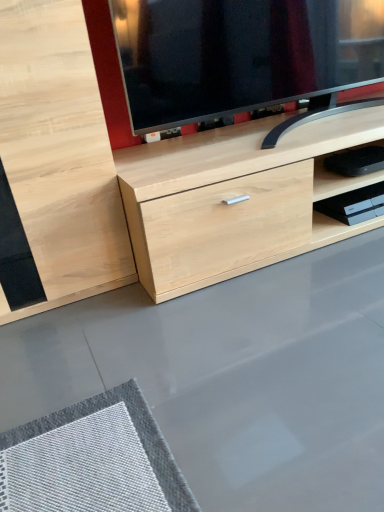
Question: From the image's perspective, is black plastic device at lower right located above or below black plastic shelf at lower right?

Choices:
 (A) above
 (B) below

Answer: (A)

Question: Is black plastic device at lower right wider or thinner than black plastic shelf at lower right?

Choices:
 (A) thin
 (B) wide

Answer: (B)

Question: From a real-world perspective, relative to black plastic shelf at lower right, is black plastic device at lower right vertically above or below?

Choices:
 (A) above
 (B) below

Answer: (A)

Question: Considering the positions of black plastic shelf at lower right and black plastic device at lower right in the image, is black plastic shelf at lower right bigger or smaller than black plastic device at lower right?

Choices:
 (A) small
 (B) big

Answer: (A)

Question: Is point (367, 185) closer or farther from the camera than point (374, 157)?

Choices:
 (A) farther
 (B) closer

Answer: (A)

Question: Considering the positions of black plastic shelf at lower right and black plastic device at lower right in the image, is black plastic shelf at lower right taller or shorter than black plastic device at lower right?

Choices:
 (A) short
 (B) tall

Answer: (A)

Question: Considering the relative positions of black plastic shelf at lower right and black plastic device at lower right in the image provided, is black plastic shelf at lower right to the left or to the right of black plastic device at lower right?

Choices:
 (A) right
 (B) left

Answer: (A)